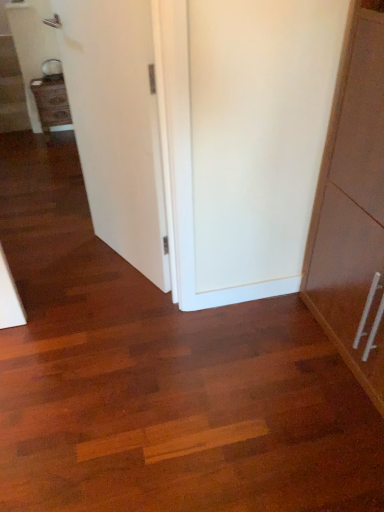
In order to face wooden staircase at left, should I rotate leftwards or rightwards?

Turn left approximately 23.210 degrees to face it.

In the scene shown: In order to face matte wood cabinet at left, should I rotate leftwards or rightwards?

Rotate left and turn 17.778 degrees.

Locate an element on the screen. Image resolution: width=384 pixels, height=512 pixels. wooden staircase at left is located at coordinates (11, 90).

Is matte wood cabinet at left at the back of white smooth door at center?

No, white smooth door at center is not facing away from matte wood cabinet at left.

Which of these two, white smooth door at center or matte wood cabinet at left, stands shorter?

matte wood cabinet at left is shorter.

How different are the orientations of white smooth door at center and matte wood cabinet at left in degrees?

white smooth door at center and matte wood cabinet at left are facing 67.3 degrees away from each other.

Can you confirm if white smooth door at center is bigger than matte wood cabinet at left?

Correct, white smooth door at center is larger in size than matte wood cabinet at left.

Between wooden staircase at left and matte wood cabinet at left, which one has larger width?

wooden staircase at left is wider.

Looking at this image, which of these two, wooden staircase at left or matte wood cabinet at left, stands shorter?

wooden staircase at left.

How different are the orientations of wooden staircase at left and matte wood cabinet at left in degrees?

wooden staircase at left and matte wood cabinet at left are facing 0.251 degrees away from each other.

Is point (1, 74) positioned before point (51, 96)?

No.

Does white smooth door at center have a greater width compared to wooden staircase at left?

In fact, white smooth door at center might be narrower than wooden staircase at left.

Do you think white smooth door at center is within wooden staircase at left, or outside of it?

white smooth door at center is not enclosed by wooden staircase at left.

Which is less distant, (105, 22) or (9, 108)?

Positioned in front is point (105, 22).

Which of these two, wooden staircase at left or white smooth door at center, is smaller?

white smooth door at center.

Does wooden staircase at left have a greater width compared to white smooth door at center?

Yes.

Between point (5, 116) and point (125, 92), which one is positioned behind?

The point (5, 116) is farther.

Are wooden staircase at left and white smooth door at center beside each other?

No, wooden staircase at left is not in contact with white smooth door at center.

From the image's perspective, relative to white smooth door at center, is matte wood cabinet at left above or below?

matte wood cabinet at left is situated higher than white smooth door at center in the image.

Can you confirm if matte wood cabinet at left is shorter than white smooth door at center?

Indeed, matte wood cabinet at left has a lesser height compared to white smooth door at center.

Which of these two, matte wood cabinet at left or wooden staircase at left, is thinner?

matte wood cabinet at left.

Considering the positions of objects matte wood cabinet at left and wooden staircase at left in the image provided, who is more to the right, matte wood cabinet at left or wooden staircase at left?

matte wood cabinet at left is more to the right.

From the picture: From a real-world perspective, is matte wood cabinet at left positioned over wooden staircase at left based on gravity?

Yes, from a real-world perspective, matte wood cabinet at left is over wooden staircase at left

There is a matte wood cabinet at left. Where is `door above it (from a real-world perspective)`? door above it (from a real-world perspective) is located at coordinates (117, 126).

The height and width of the screenshot is (512, 384). In the image, there is a matte wood cabinet at left. In order to click on stairwell below it (from a real-world perspective) in this screenshot , I will do `click(11, 90)`.

Considering their positions, is wooden staircase at left positioned closer to matte wood cabinet at left than white smooth door at center?

wooden staircase at left is closer to matte wood cabinet at left.

Estimate the real-world distances between objects in this image. Which object is closer to wooden staircase at left, white smooth door at center or matte wood cabinet at left?

Based on the image, matte wood cabinet at left appears to be nearer to wooden staircase at left.

From the image, which object appears to be farther from matte wood cabinet at left, white smooth door at center or wooden staircase at left?

Based on the image, white smooth door at center appears to be further to matte wood cabinet at left.

From the image, which object appears to be farther from white smooth door at center, wooden staircase at left or matte wood cabinet at left?

The object further to white smooth door at center is wooden staircase at left.

Which object lies further to the anchor point white smooth door at center, matte wood cabinet at left or wooden staircase at left?

The object further to white smooth door at center is wooden staircase at left.

Based on their spatial positions, is matte wood cabinet at left or white smooth door at center closer to wooden staircase at left?

Based on the image, matte wood cabinet at left appears to be nearer to wooden staircase at left.

Find the location of a particular element. cabinetry between white smooth door at center and wooden staircase at left along the z-axis is located at coordinates (51, 102).